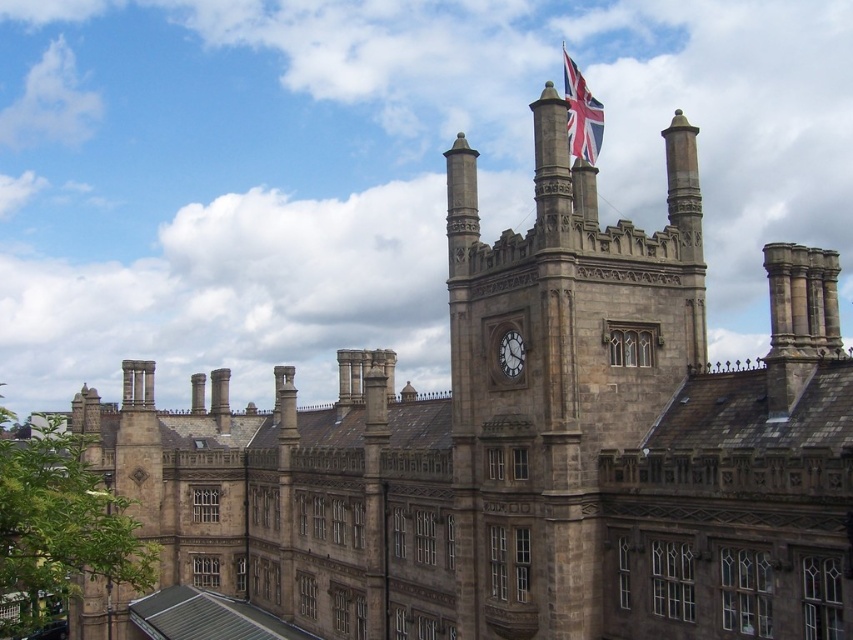
You are standing in front of the historic building and want to take a photo. You notice two points marked on the roof. Which of the two points, point (512, 458) or point (579, 72), is closer to your current position when you look at them through the camera lens?

Point (512, 458) is closer to the camera than point (579, 72), so it will appear closer in the photo.

You are an architect examining the building and need to determine the spatial relationship between the stone clock tower at center and the polished stone clock at center. Which one has a greater width?

The stone clock tower at center is wider than the polished stone clock at center according to the description provided.

You are standing in front of a historic building with a stone clock tower at center. You want to take a photo of the entire building without any obstructions. Considering the distance, do you think you can capture the entire structure in one shot from your current position?

The stone clock tower at center is 173.33 feet away from the viewer. From this distance, it is likely possible to capture the entire building in one shot without obstructions, as the clock tower is positioned centrally and the other elements are within the same frame.